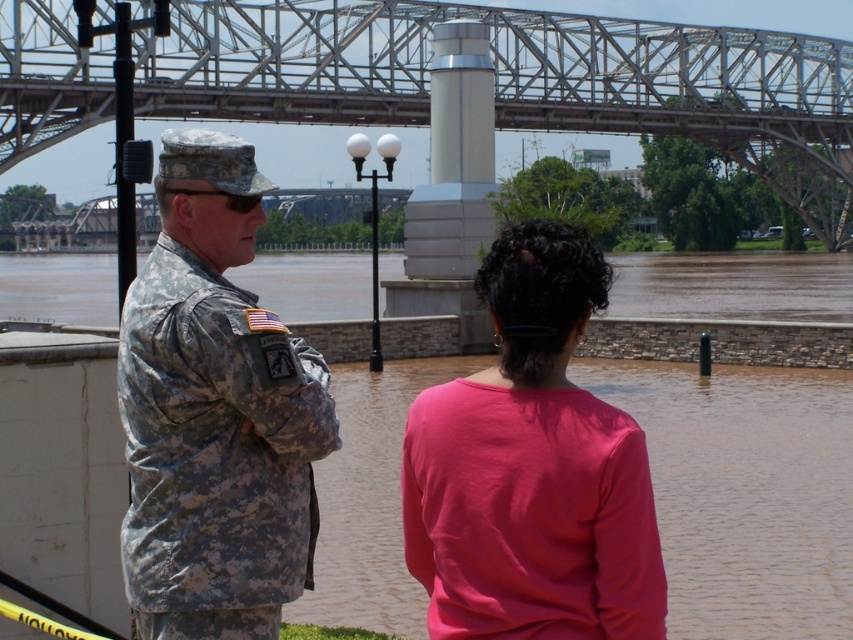
You are a photographer trying to capture both the camouflage uniform at center and the pink matte shirt at center in a single frame. Given that your camera has a fixed focal length and limited depth of field, which subject should you focus on to ensure the larger one is in sharp focus?

The camouflage uniform at center is larger than the pink matte shirt at center, so focusing on the camouflage uniform at center will ensure the larger subject is in sharp focus.

You are a rescue worker standing at the riverside and need to reach the metallic steel bridge at upper center. Given that your boat can travel 10 meters per minute, how many minutes will it take to reach the bridge?

The metallic steel bridge at upper center is 65.75 meters from viewer. At a speed of 10 meters per minute, it will take approximately 6.575 minutes to reach the bridge. Since you can round to the nearest whole number, it would take about 7 minutes.